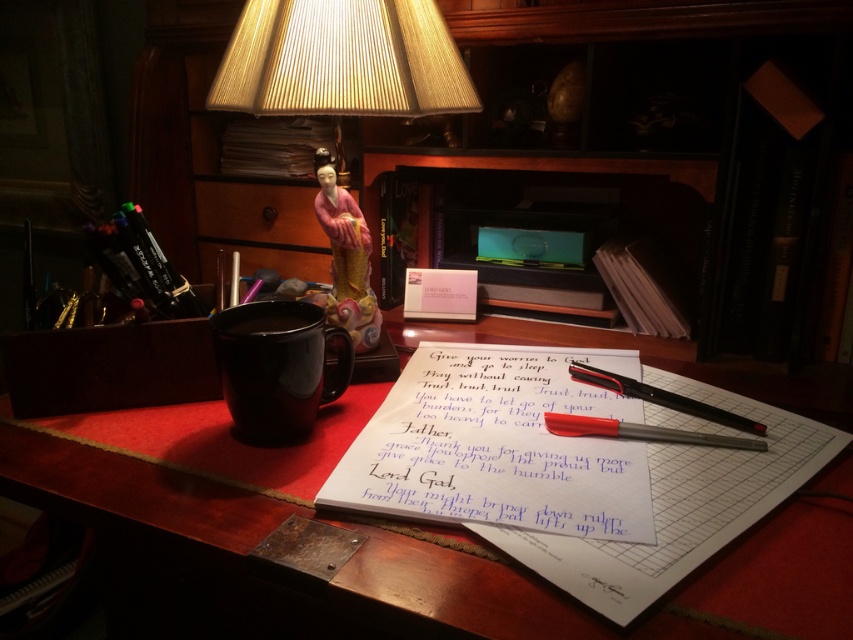
Who is shorter, smooth wooden table at center or red plastic pen at center?

red plastic pen at center

Does point (84, 445) lie in front of point (575, 365)?

Yes.

At what (x,y) coordinates should I click in order to perform the action: click on smooth wooden table at center. Please return your answer as a coordinate pair (x, y). Looking at the image, I should click on (395, 564).

Does white paper notebook at center appear on the left side of red plastic pen at center?

Indeed, white paper notebook at center is positioned on the left side of red plastic pen at center.

Who is lower down, white paper notebook at center or red plastic pen at center?

white paper notebook at center is below.

Who is more distant from viewer, (525, 429) or (666, 396)?

Positioned behind is point (666, 396).

Where is `white paper notebook at center`? This screenshot has height=640, width=853. white paper notebook at center is located at coordinates (498, 445).

Is white paper notebook at center closer to camera compared to white paper with handwritten text at center?

That is False.

Is point (618, 349) positioned behind point (680, 483)?

Yes, it is.

Between point (364, 432) and point (811, 456), which one is positioned in front?

Positioned in front is point (811, 456).

I want to click on white paper notebook at center, so click(x=498, y=445).